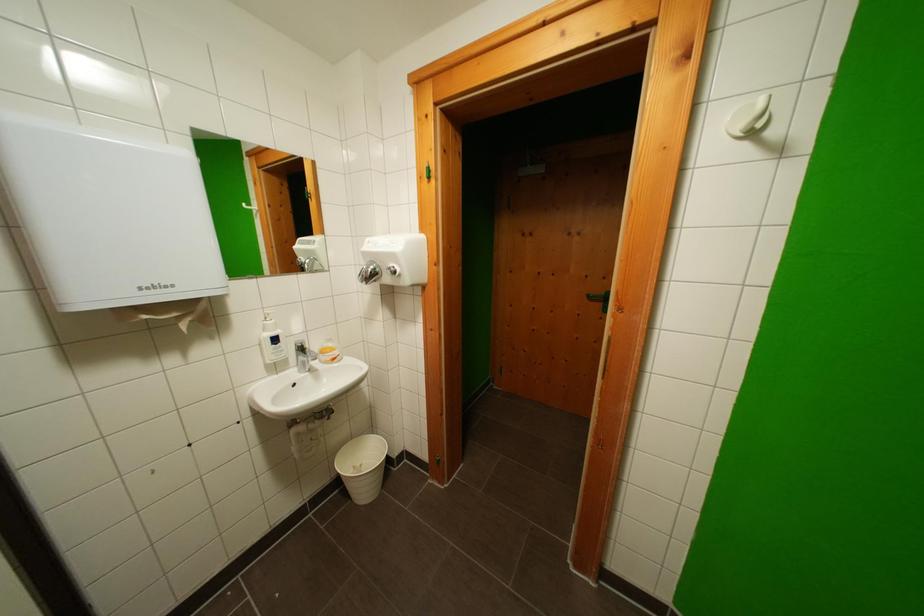
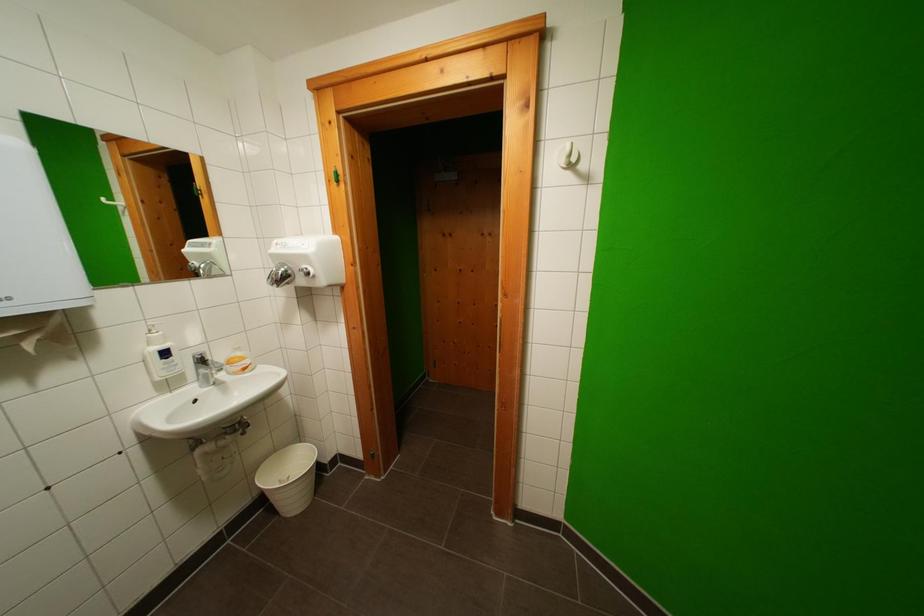
Question: The camera is either moving clockwise (left) or counter-clockwise (right) around the object. The first image is from the beginning of the video and the second image is from the end. Is the camera moving left or right when shooting the video?

Choices:
 (A) Left
 (B) Right

Answer: (A)